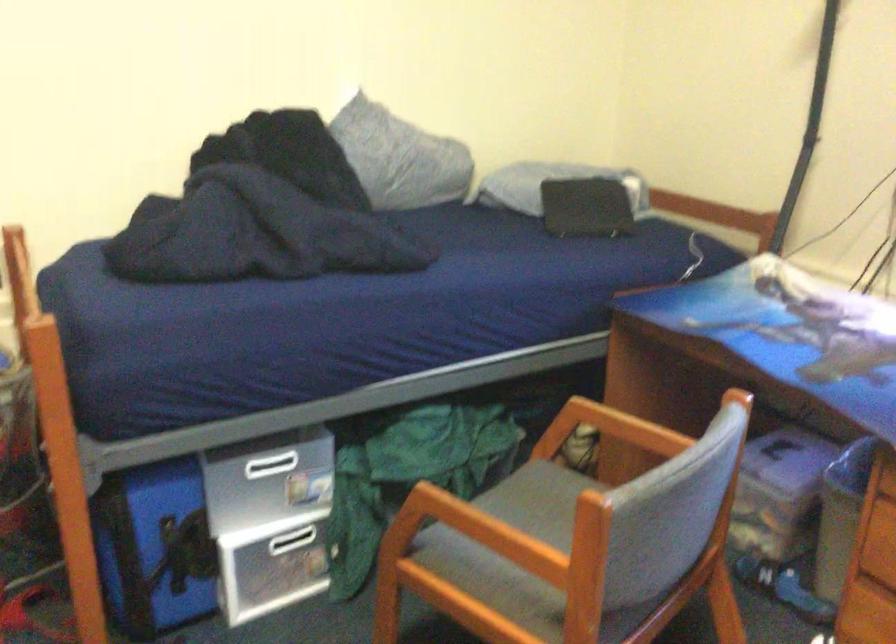
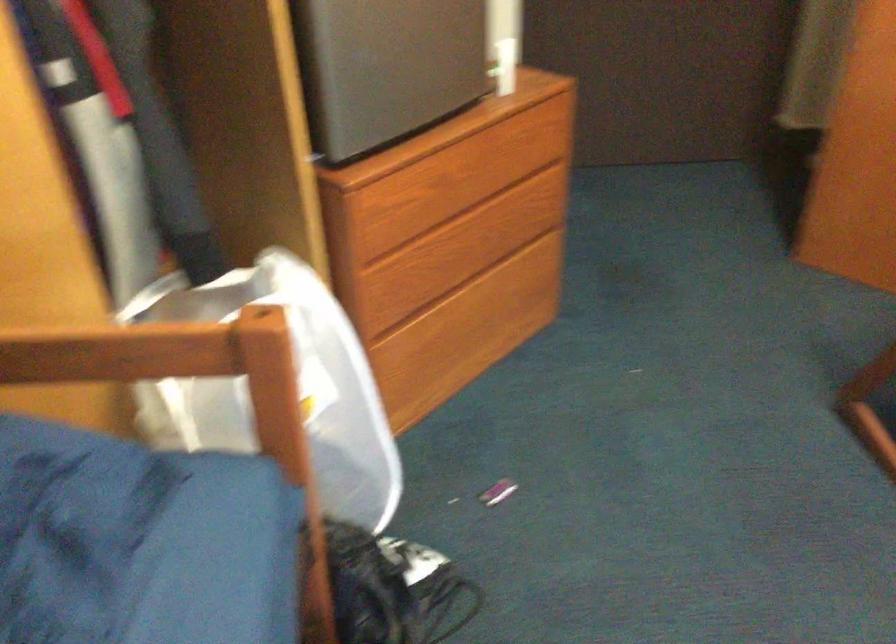
The images are taken continuously from a first-person perspective. In which direction is your viewpoint rotating?

The rotation direction of the camera is left-down.